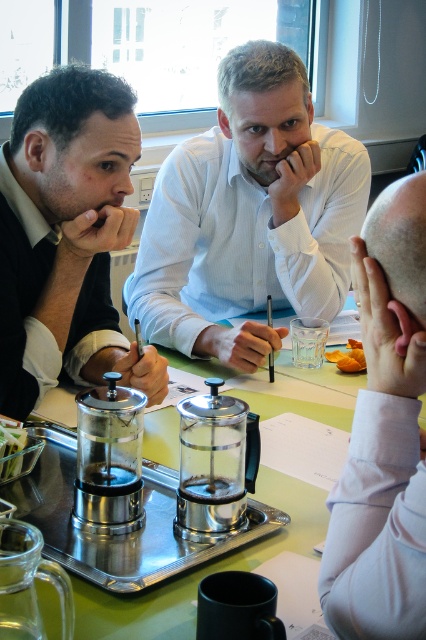
Question: Considering the relative positions of white textured shirt at center and clear glass tray at center in the image provided, where is white textured shirt at center located with respect to clear glass tray at center?

Choices:
 (A) right
 (B) left

Answer: (A)

Question: In this image, where is matte black shirt at left located relative to smooth skin head at right?

Choices:
 (A) left
 (B) right

Answer: (A)

Question: Which point is farther from the camera taking this photo?

Choices:
 (A) (340, 582)
 (B) (26, 493)
 (C) (132, 224)

Answer: (C)

Question: Is matte black shirt at left smaller than clear glass tray at center?

Choices:
 (A) no
 (B) yes

Answer: (B)

Question: Which point is closer to the camera taking this photo?

Choices:
 (A) (164, 410)
 (B) (362, 346)
 (C) (347, 266)
 (D) (417, 493)

Answer: (D)

Question: Which of these objects is positioned closest to the matte black shirt at left?

Choices:
 (A) orange matte food at center
 (B) clear glass tray at center
 (C) smooth skin head at right
 (D) white textured shirt at center

Answer: (B)